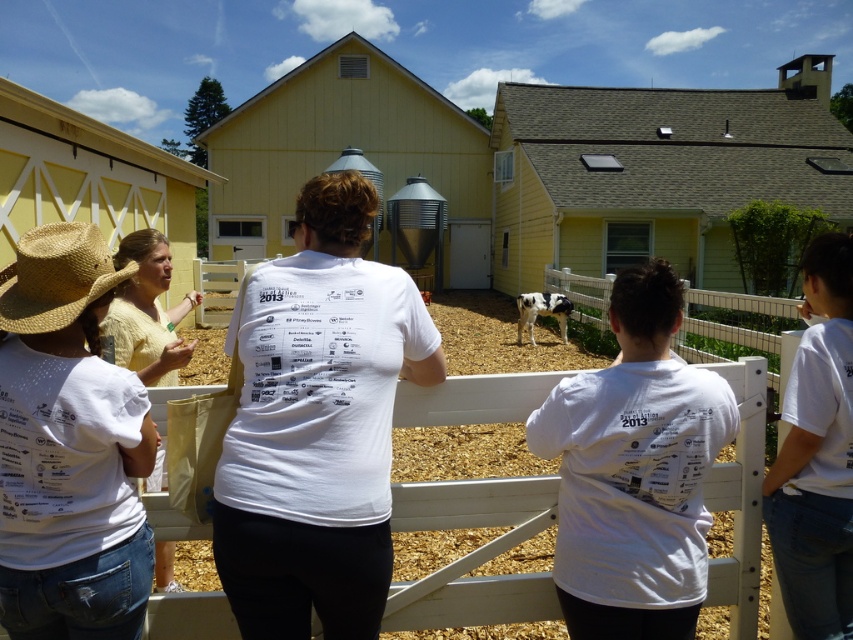
Does white matte t-shirt at center have a greater width compared to white cotton shirt at left?

Yes, white matte t-shirt at center is wider than white cotton shirt at left.

Measure the distance between white matte t-shirt at center and camera.

They are 1.98 meters apart.

Where is `white matte t-shirt at center`? The image size is (853, 640). white matte t-shirt at center is located at coordinates (317, 424).

Does white matte t-shirt at center appear under yellow painted barn at center?

Indeed, white matte t-shirt at center is positioned under yellow painted barn at center.

From the picture: Who is more distant from viewer, (358, 566) or (270, 104)?

The point (270, 104) is behind.

Between point (310, 541) and point (463, 161), which one is positioned behind?

The point (463, 161) is more distant.

In order to click on white matte t-shirt at center in this screenshot , I will do `click(317, 424)`.

Between point (799, 113) and point (521, 320), which one is positioned in front?

Point (521, 320)

Is yellow siding at upper center positioned behind black and white spotted calf at center?

That is True.

Between point (726, 102) and point (529, 332), which one is positioned behind?

Point (726, 102)

Locate an element on the screen. Image resolution: width=853 pixels, height=640 pixels. yellow siding at upper center is located at coordinates (657, 172).